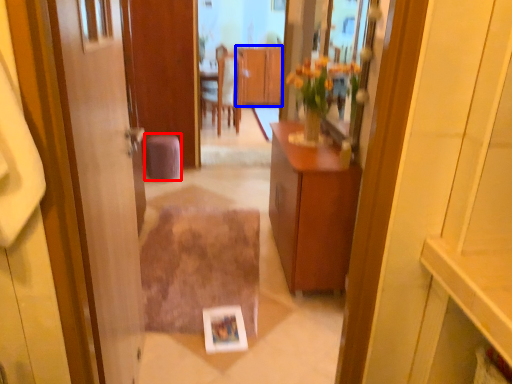
Question: Which of the following is the farthest to the observer, stool (highlighted by a red box) or cabinetry (highlighted by a blue box)?

Choices:
 (A) stool
 (B) cabinetry

Answer: (B)